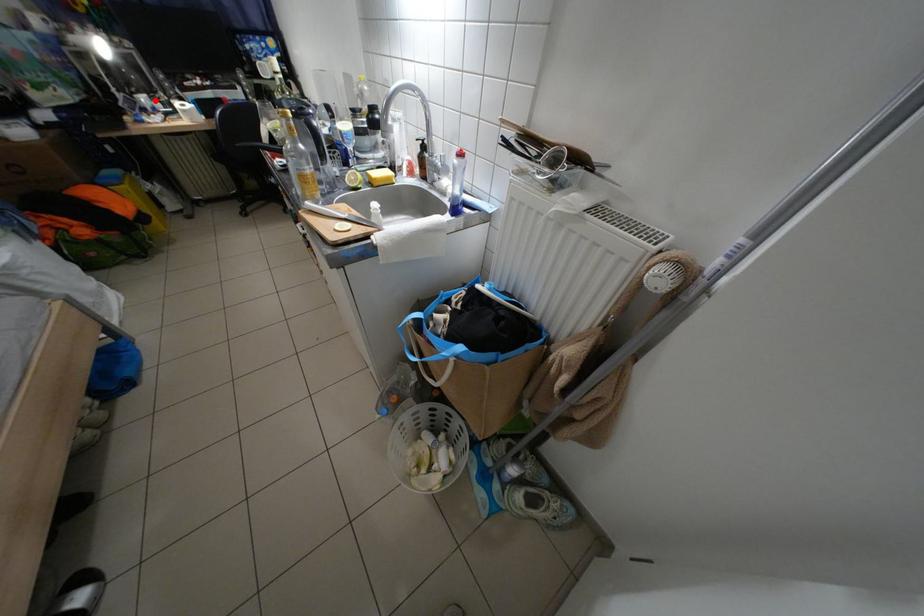
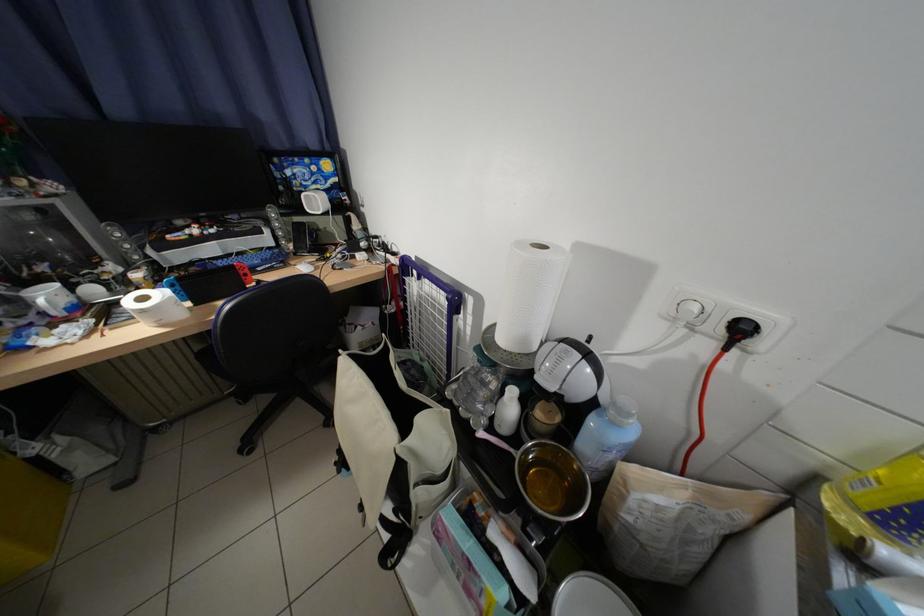
Where in the second image is the point corresponding to the highlighted location from the first image?

(59, 297)